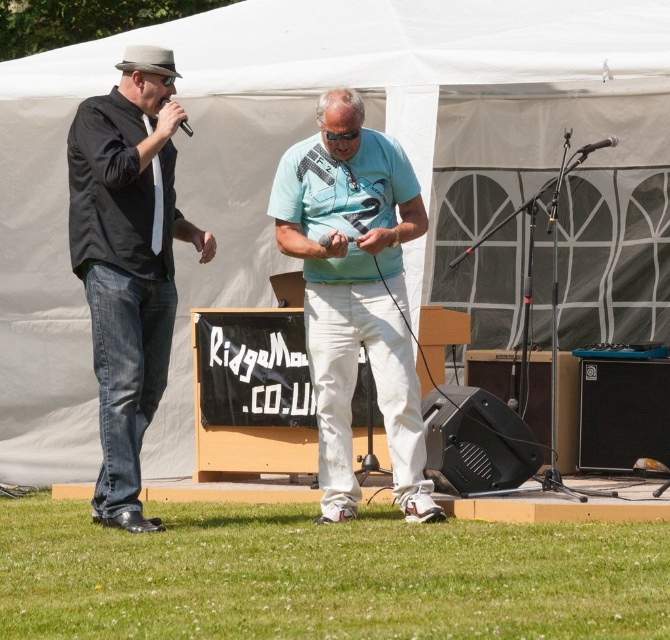
Question: Estimate the real-world distances between objects in this image. Which object is closer to the black matte microphone at center?

Choices:
 (A) black matte shirt at left
 (B) light blue cotton shirt at center
 (C) metallic silver microphone at upper right

Answer: (B)

Question: Is black matte shirt at left further to the viewer compared to black matte microphone at center?

Choices:
 (A) yes
 (B) no

Answer: (A)

Question: Where is light blue cotton shirt at center located in relation to black matte microphone at center in the image?

Choices:
 (A) left
 (B) right

Answer: (B)

Question: Estimate the real-world distances between objects in this image. Which object is farther from the light blue cotton shirt at center?

Choices:
 (A) black plastic microphone at upper left
 (B) black matte microphone at center
 (C) black matte shirt at left

Answer: (A)

Question: Which of these objects is positioned closest to the light blue cotton shirt at center?

Choices:
 (A) metallic silver microphone at upper right
 (B) black matte microphone at center
 (C) black plastic microphone at upper left
 (D) black matte shirt at left

Answer: (B)

Question: Is metallic silver microphone at upper right thinner than black matte microphone at center?

Choices:
 (A) no
 (B) yes

Answer: (A)